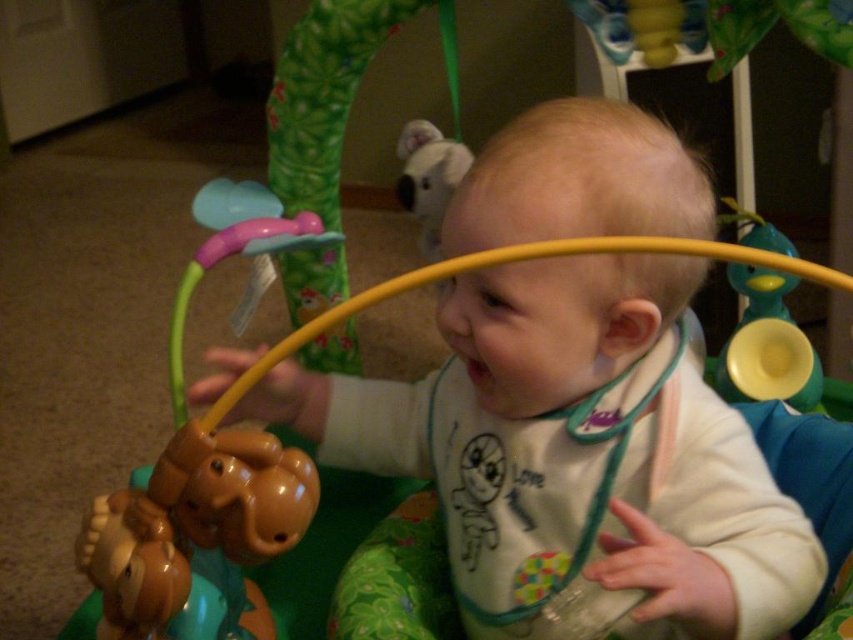
Can you confirm if white matte bib at center is positioned above fluffy white plush at upper center?

No, white matte bib at center is not above fluffy white plush at upper center.

Who is more distant from viewer, (635,164) or (421,180)?

Point (421,180)

The width and height of the screenshot is (853, 640). I want to click on white matte bib at center, so click(572, 451).

Identify the location of white matte bib at center. (572, 451).